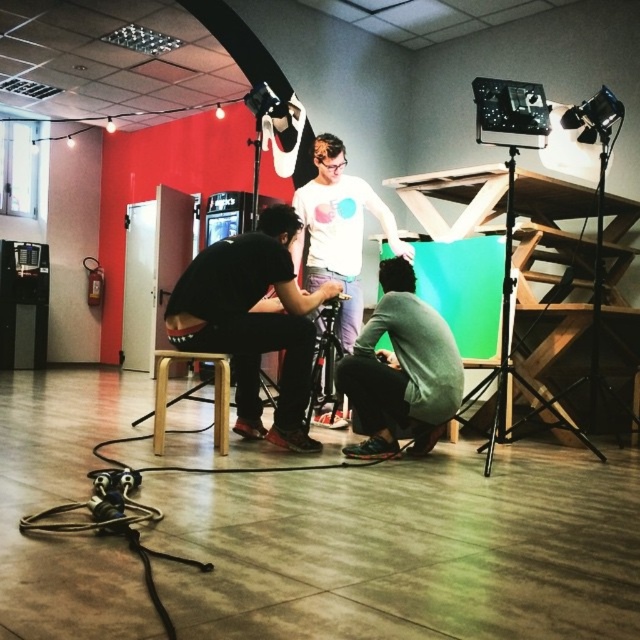
Question: Which of the following is the closest to the observer?

Choices:
 (A) black metal tripod at upper right
 (B) white matte shirt at center

Answer: (A)

Question: From the image, what is the correct spatial relationship of gray fabric squat at lower right in relation to black metal tripod at upper right?

Choices:
 (A) left
 (B) right

Answer: (A)

Question: Which object is the farthest from the black matte stool at center?

Choices:
 (A) black metal tripod at upper right
 (B) light brown wooden stool at center

Answer: (A)

Question: Is black metal tripod at upper right in front of light brown wooden stool at center?

Choices:
 (A) no
 (B) yes

Answer: (B)

Question: Among these objects, which one is nearest to the camera?

Choices:
 (A) gray fabric squat at lower right
 (B) black metal tripod at upper right
 (C) black matte stool at center

Answer: (B)

Question: Does black matte stool at center appear over black metal tripod at upper right?

Choices:
 (A) no
 (B) yes

Answer: (B)